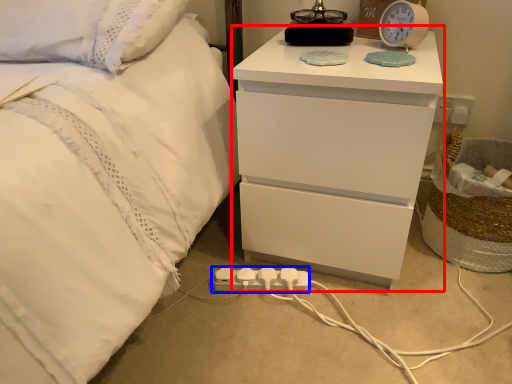
Question: Which point is closer to the camera, nightstand (highlighted by a red box) or extension cord (highlighted by a blue box)?

Choices:
 (A) nightstand
 (B) extension cord

Answer: (A)